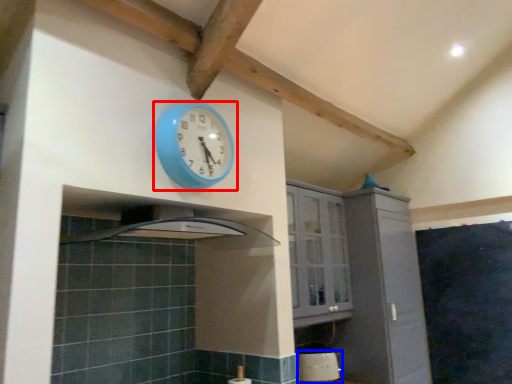
Question: Which point is further to the camera, wall clock (highlighted by a red box) or appliance (highlighted by a blue box)?

Choices:
 (A) wall clock
 (B) appliance

Answer: (B)